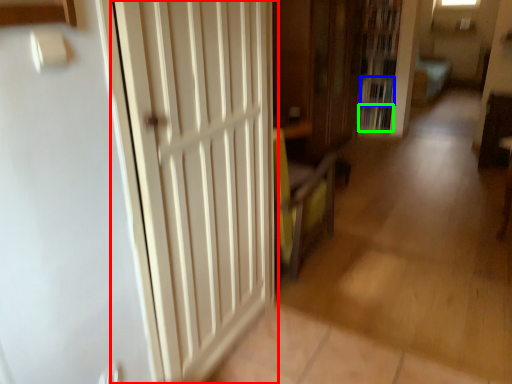
Question: Estimate the real-world distances between objects in this image. Which object is closer to door (highlighted by a red box), book (highlighted by a blue box) or book (highlighted by a green box)?

Choices:
 (A) book
 (B) book

Answer: (A)